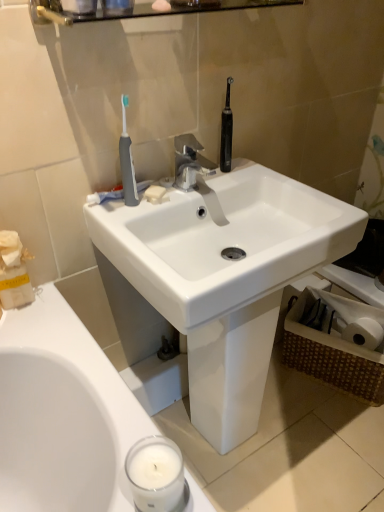
You are a GUI agent. You are given a task and a screenshot of the screen. Output one action in this format:
    pyautogui.click(x=<x>, y=<y>)
    Task: Click on the vacant space positioned to the left of white matte soap at sink center
    The height and width of the screenshot is (512, 384).
    Given the screenshot: What is the action you would take?
    pyautogui.click(x=122, y=199)